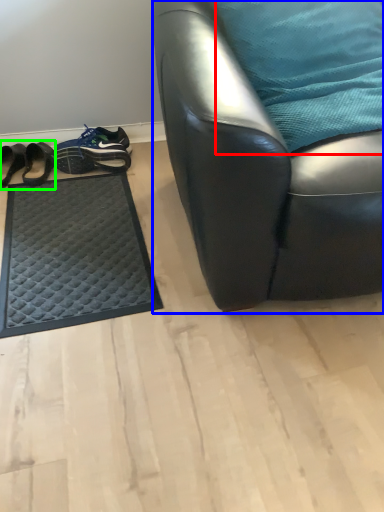
Question: Considering the real-world distances, which object is closest to pillow (highlighted by a red box)? chair (highlighted by a blue box) or footwear (highlighted by a green box).

Choices:
 (A) chair
 (B) footwear

Answer: (A)